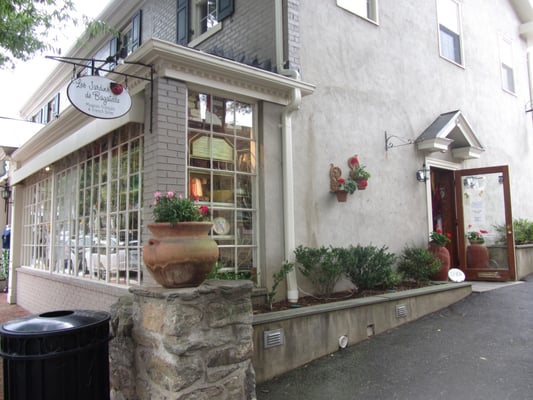
Locate an element on the screen. The image size is (533, 400). clay pot is located at coordinates [x=185, y=249].